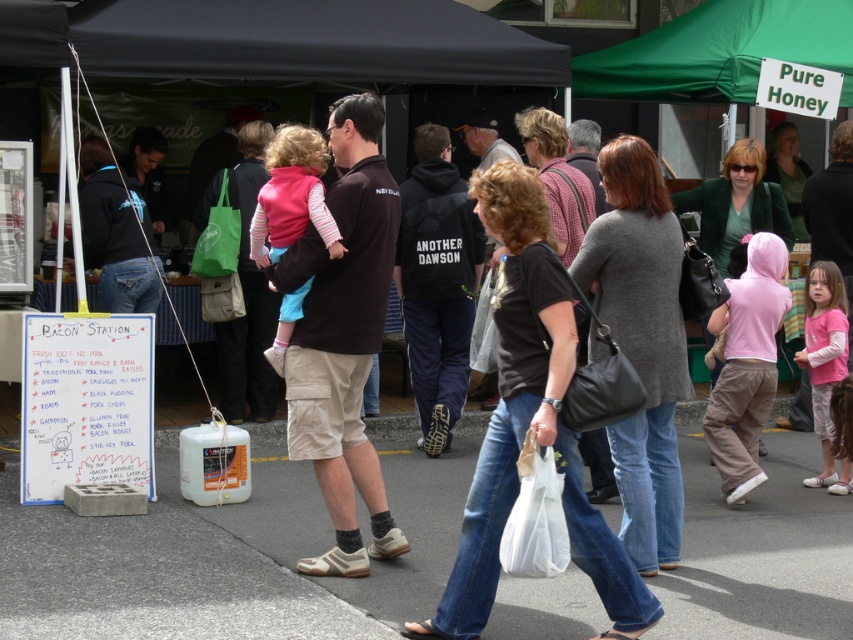
Consider the image. You are a customer at the market and want to approach the BACON STATION. You see a black cotton shirt at center and a gray knitted sweater at center in your path. Which clothing item do you need to move around to reach the BACON STATION?

The black cotton shirt at center is in front of the gray knitted sweater at center, so you need to move around the black cotton shirt at center to reach the BACON STATION.

You are a fashion blogger who wants to write about the clothing items in the image. Which clothing item, the black cotton shirt at center or the gray knitted sweater at center, is shorter in length?

The black cotton shirt at center is shorter than the gray knitted sweater at center.

You are a delivery drone flying over the market. You need to land on the gray asphalt pavement at lower center. However, there is a green matte jacket at upper center in the way. Can you land safely without hitting the jacket?

The gray asphalt pavement at lower center occupies less space than the green matte jacket at upper center, so there might not be enough space to land safely without hitting the jacket.